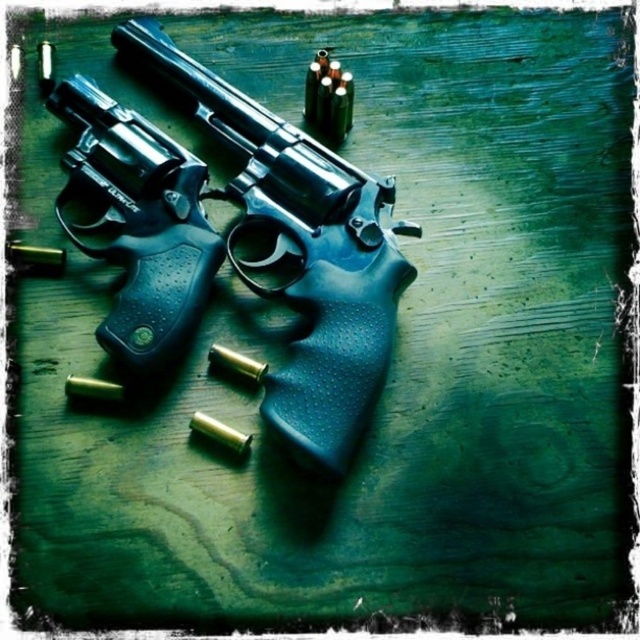
Does polished metal revolver at center appear over matte black revolver at center?

Yes, polished metal revolver at center is above matte black revolver at center.

Does polished metal revolver at center have a larger size compared to matte black revolver at center?

Yes, polished metal revolver at center is bigger than matte black revolver at center.

Where is `polished metal revolver at center`? The image size is (640, 640). polished metal revolver at center is located at coordinates (301, 250).

You are a GUI agent. You are given a task and a screenshot of the screen. Output one action in this format:
    pyautogui.click(x=<x>, y=<y>)
    Task: Click on the polished metal revolver at center
    
    Given the screenshot: What is the action you would take?
    pyautogui.click(x=301, y=250)